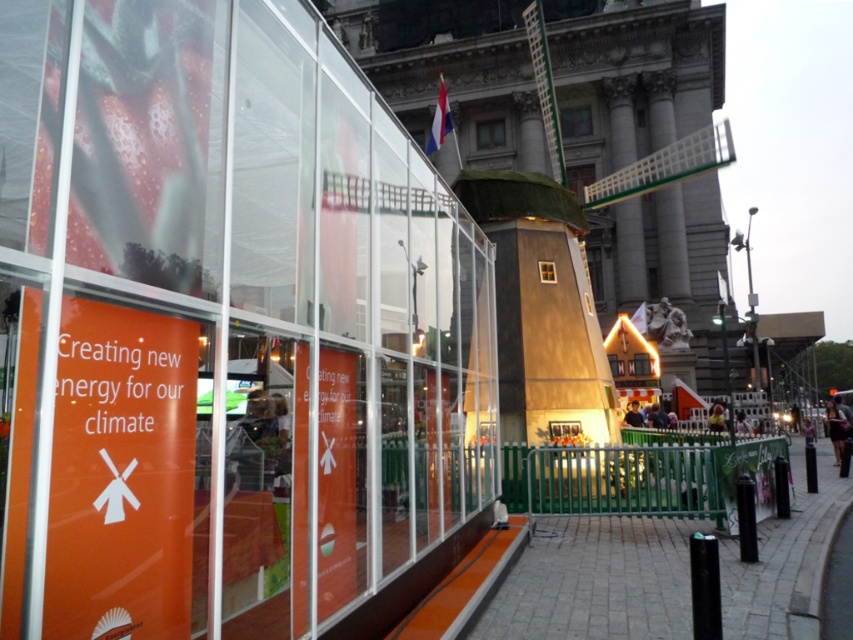
Question: Where is paved stone pavement at center located in relation to wooden windmill at center in the image?

Choices:
 (A) right
 (B) left

Answer: (A)

Question: Considering the relative positions of orange matte sign at lower left and paved stone pavement at center in the image provided, where is orange matte sign at lower left located with respect to paved stone pavement at center?

Choices:
 (A) right
 (B) left

Answer: (B)

Question: Which is farther from the paved stone pavement at center?

Choices:
 (A) wooden windmill at center
 (B) orange matte sign at lower left

Answer: (B)

Question: Does orange matte sign at lower left have a larger size compared to wooden windmill at center?

Choices:
 (A) yes
 (B) no

Answer: (A)

Question: Which object is the closest to the paved stone pavement at center?

Choices:
 (A) orange matte sign at lower left
 (B) wooden windmill at center

Answer: (B)

Question: Considering the real-world distances, which object is farthest from the wooden windmill at center?

Choices:
 (A) paved stone pavement at center
 (B) orange matte sign at lower left

Answer: (B)